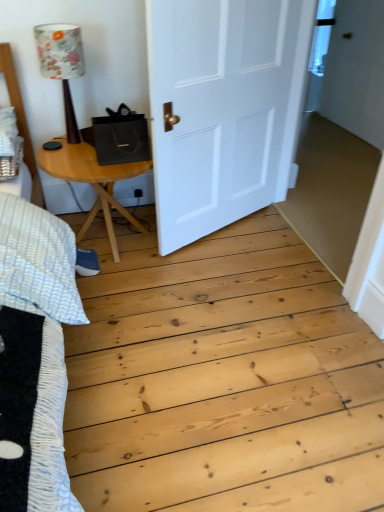
Question: Relative to light brown wooden table at left, is floral fabric lampshade at upper left in front or behind?

Choices:
 (A) behind
 (B) front

Answer: (B)

Question: From the image's perspective, is floral fabric lampshade at upper left above or below light brown wooden table at left?

Choices:
 (A) below
 (B) above

Answer: (B)

Question: Considering the real-world distances, which object is farthest from the light brown wooden table at left?

Choices:
 (A) floral fabric lampshade at upper left
 (B) white matte door at center

Answer: (B)

Question: Based on their relative distances, which object is farther from the light brown wooden table at left?

Choices:
 (A) white matte door at center
 (B) floral fabric lampshade at upper left

Answer: (A)